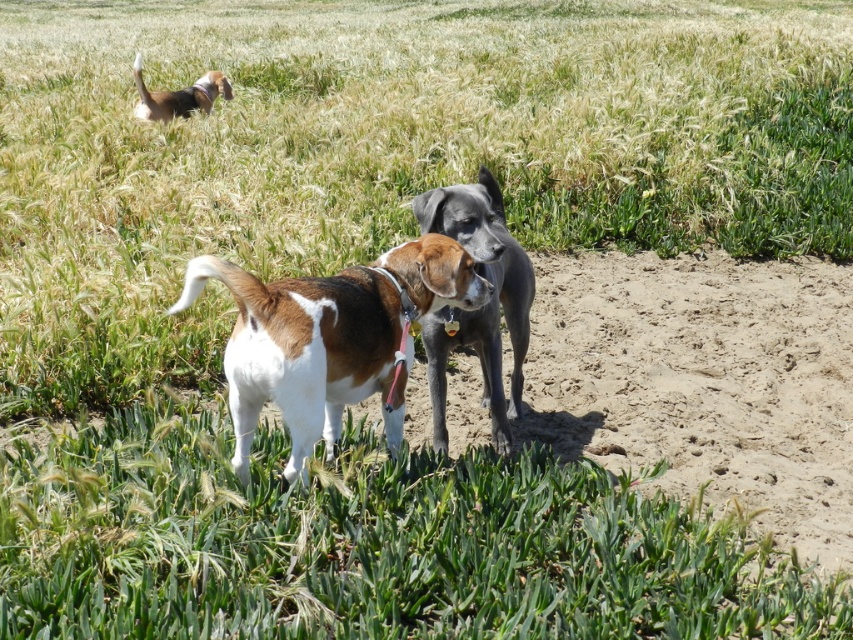
Question: Does brown and white fur dog at center appear on the left side of smooth gray dog at center?

Choices:
 (A) no
 (B) yes

Answer: (B)

Question: Which object is positioned closest to the brown and white fur dog at center?

Choices:
 (A) green leafy grass at center
 (B) smooth gray dog at center
 (C) brown and white fur at upper left

Answer: (B)

Question: Does green leafy grass at center come behind smooth gray dog at center?

Choices:
 (A) no
 (B) yes

Answer: (A)

Question: Which object is the farthest from the brown and white fur at upper left?

Choices:
 (A) green leafy grass at center
 (B) brown and white fur dog at center

Answer: (A)

Question: Among these points, which one is nearest to the camera?

Choices:
 (A) coord(456,228)
 (B) coord(24,454)
 (C) coord(357,316)

Answer: (C)

Question: Does green leafy grass at center have a smaller size compared to smooth gray dog at center?

Choices:
 (A) yes
 (B) no

Answer: (B)